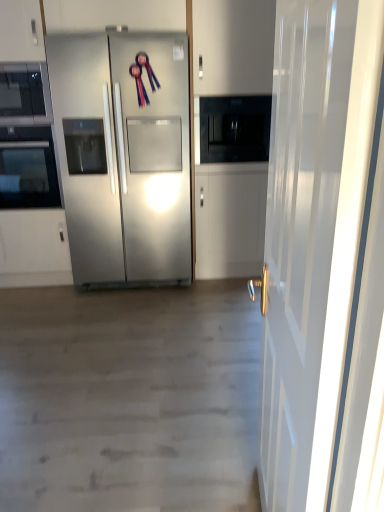
What do you see at coordinates (28, 168) in the screenshot?
I see `black glass oven at left` at bounding box center [28, 168].

I want to click on matte black microwave at upper left, so click(24, 92).

You are a GUI agent. You are given a task and a screenshot of the screen. Output one action in this format:
    pyautogui.click(x=<x>, y=<y>)
    Task: Click on the black glass microwave at center
    The height and width of the screenshot is (512, 384).
    Given the screenshot: What is the action you would take?
    pyautogui.click(x=235, y=129)

This screenshot has height=512, width=384. What do you see at coordinates (301, 239) in the screenshot?
I see `white glossy door at right` at bounding box center [301, 239].

Locate an element on the screen. This screenshot has width=384, height=512. stainless steel refrigerator at center is located at coordinates (128, 155).

The width and height of the screenshot is (384, 512). I want to click on black glass oven at left, so tap(28, 168).

From the picture: From the image's perspective, between black glass oven at left and stainless steel refrigerator at center, who is located below?

black glass oven at left.

Which is nearer, (50, 191) or (66, 109)?

The point (66, 109) is in front.

Based on the photo, does black glass oven at left contain stainless steel refrigerator at center?

No, stainless steel refrigerator at center is not surrounded by black glass oven at left.

From the picture: What's the angular difference between black glass oven at left and matte black microwave at upper left's facing directions?

black glass oven at left and matte black microwave at upper left are facing 0.234 degrees away from each other.

Could you tell me if black glass oven at left is facing matte black microwave at upper left?

No, black glass oven at left is not aimed at matte black microwave at upper left.

Would you consider black glass oven at left to be distant from matte black microwave at upper left?

No, black glass oven at left is not far away from matte black microwave at upper left.

Which of these two, black glass oven at left or matte black microwave at upper left, stands shorter?

With less height is matte black microwave at upper left.

Does point (33, 101) lie behind point (315, 456)?

Yes, it is behind point (315, 456).

Are matte black microwave at upper left and white glossy door at right beside each other?

matte black microwave at upper left is not next to white glossy door at right, and they're not touching.

Which object is positioned more to the right, matte black microwave at upper left or white glossy door at right?

Positioned to the right is white glossy door at right.

From a real-world perspective, which is physically above, matte black microwave at upper left or white glossy door at right?

In real-world perspective, matte black microwave at upper left is above.

Which object is further away from the camera, stainless steel refrigerator at center or black glass oven at left?

black glass oven at left is more distant.

Is stainless steel refrigerator at center spatially inside black glass oven at left, or outside of it?

stainless steel refrigerator at center exists outside the volume of black glass oven at left.

Is stainless steel refrigerator at center oriented away from black glass oven at left?

No, stainless steel refrigerator at center's orientation is not away from black glass oven at left.

Which point is more distant from viewer, (164, 144) or (35, 175)?

The point (35, 175) is behind.

From the picture: From the image's perspective, between black glass oven at left and black glass microwave at center, which one is located above?

From the image's view, black glass microwave at center is above.

In terms of width, does black glass oven at left look wider or thinner when compared to black glass microwave at center?

Considering their sizes, black glass oven at left looks slimmer than black glass microwave at center.

Which is farther from the camera, [30,198] or [218,141]?

The point [30,198] is behind.

Considering the sizes of objects white glossy door at right and black glass oven at left in the image provided, who is bigger, white glossy door at right or black glass oven at left?

With larger size is white glossy door at right.

Can you see white glossy door at right touching black glass oven at left?

No, white glossy door at right is not with black glass oven at left.

Does white glossy door at right contain black glass oven at left?

Definitely not — black glass oven at left is not inside white glossy door at right.

In the scene shown: Is black glass microwave at center positioned with its back to stainless steel refrigerator at center?

No, black glass microwave at center is not facing the opposite direction of stainless steel refrigerator at center.

Is black glass microwave at center thinner than stainless steel refrigerator at center?

Yes, black glass microwave at center is thinner than stainless steel refrigerator at center.

In terms of height, does black glass microwave at center look taller or shorter compared to stainless steel refrigerator at center?

In the image, black glass microwave at center appears to be shorter than stainless steel refrigerator at center.

Which is in front, point (256, 139) or point (54, 88)?

The point (54, 88) is in front.

Image resolution: width=384 pixels, height=512 pixels. In order to click on refrigerator that is on the right side of black glass oven at left in this screenshot , I will do `click(128, 155)`.

Identify the location of microwave oven above the black glass oven at left (from the image's perspective). Image resolution: width=384 pixels, height=512 pixels. tap(24, 92).

Estimate the real-world distances between objects in this image. Which object is further from stainless steel refrigerator at center, matte black microwave at upper left or black glass microwave at center?

matte black microwave at upper left is further to stainless steel refrigerator at center.

Which object lies nearer to the anchor point white glossy door at right, black glass oven at left or matte black microwave at upper left?

matte black microwave at upper left lies closer to white glossy door at right than the other object.

Considering their positions, is black glass microwave at center positioned closer to matte black microwave at upper left than black glass oven at left?

black glass oven at left is closer to matte black microwave at upper left.

In the scene shown: Looking at the image, which one is located closer to white glossy door at right, black glass microwave at center or stainless steel refrigerator at center?

Among the two, stainless steel refrigerator at center is located nearer to white glossy door at right.

From the image, which object appears to be nearer to stainless steel refrigerator at center, black glass oven at left or black glass microwave at center?

Based on the image, black glass oven at left appears to be nearer to stainless steel refrigerator at center.

Which object lies further to the anchor point matte black microwave at upper left, white glossy door at right or black glass microwave at center?

The object further to matte black microwave at upper left is white glossy door at right.

When comparing their distances from white glossy door at right, does matte black microwave at upper left or stainless steel refrigerator at center seem further?

Based on the image, matte black microwave at upper left appears to be further to white glossy door at right.

Looking at the image, which one is located further to black glass oven at left, black glass microwave at center or white glossy door at right?

white glossy door at right.

At what (x,y) coordinates should I click in order to perform the action: click on microwave oven between black glass oven at left and black glass microwave at center in the horizontal direction. Please return your answer as a coordinate pair (x, y). The width and height of the screenshot is (384, 512). Looking at the image, I should click on (24, 92).

Find the location of a particular element. The image size is (384, 512). microwave oven between white glossy door at right and black glass oven at left along the z-axis is located at coordinates (24, 92).

Identify the location of microwave oven between black glass oven at left and stainless steel refrigerator at center in the horizontal direction. (24, 92).

Locate an element on the screen. refrigerator between black glass oven at left and black glass microwave at center is located at coordinates (128, 155).